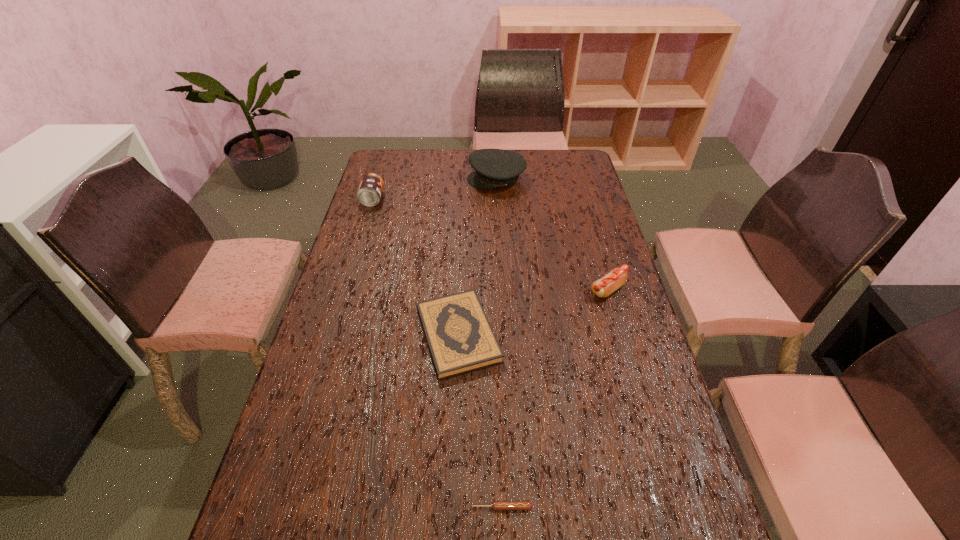
Where is `vacant region located on the front-facing side of the tallest object`? Image resolution: width=960 pixels, height=540 pixels. vacant region located on the front-facing side of the tallest object is located at coordinates (400, 179).

Where is `free region located 0.280m on the front label of the second tallest object`? free region located 0.280m on the front label of the second tallest object is located at coordinates (456, 199).

Find the location of a particular element. This screenshot has height=540, width=960. vacant space located 0.380m on the back of the rightmost object is located at coordinates (584, 207).

Image resolution: width=960 pixels, height=540 pixels. In order to click on blank space located 0.090m on the front of the fourth tallest object in this screenshot , I will do `click(454, 414)`.

This screenshot has height=540, width=960. I want to click on vacant space located on the back of the shortest object, so click(x=497, y=362).

The width and height of the screenshot is (960, 540). Identify the location of object present at the far edge. (493, 168).

At what (x,y) coordinates should I click in order to perform the action: click on object at the left edge. Please return your answer as a coordinate pair (x, y). The height and width of the screenshot is (540, 960). Looking at the image, I should click on (369, 193).

Image resolution: width=960 pixels, height=540 pixels. Identify the location of object located in the right edge section of the desktop. (617, 277).

Image resolution: width=960 pixels, height=540 pixels. Identify the location of blank space at the far edge. (462, 172).

Locate an element on the screen. free space at the left edge is located at coordinates (349, 288).